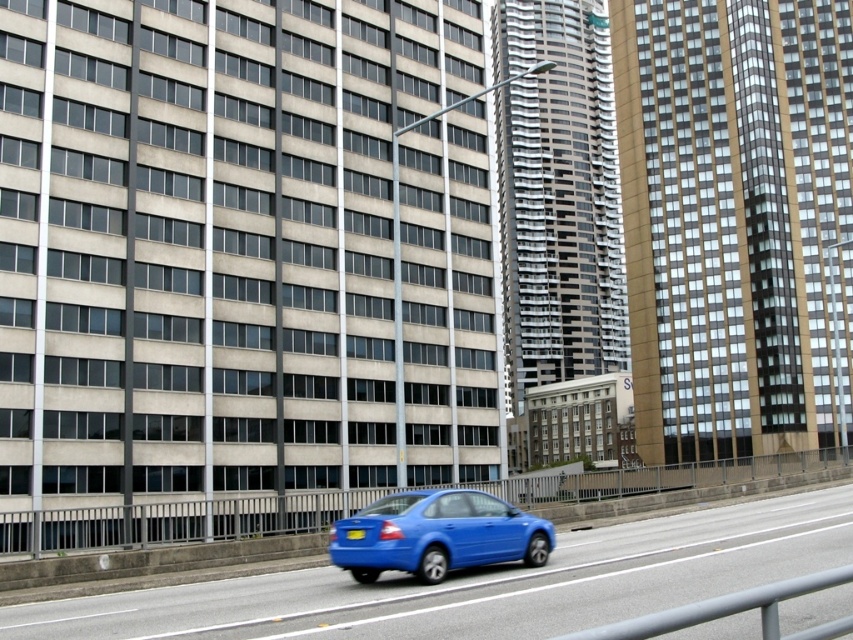
The image size is (853, 640). I want to click on smooth asphalt highway at center, so click(485, 582).

Can you confirm if smooth asphalt highway at center is thinner than glossy blue sedan at center?

In fact, smooth asphalt highway at center might be wider than glossy blue sedan at center.

Is point (643, 552) farther from viewer compared to point (347, 532)?

Yes.

You are a GUI agent. You are given a task and a screenshot of the screen. Output one action in this format:
    pyautogui.click(x=<x>, y=<y>)
    Task: Click on the smooth asphalt highway at center
    This screenshot has height=640, width=853.
    Given the screenshot: What is the action you would take?
    pyautogui.click(x=485, y=582)